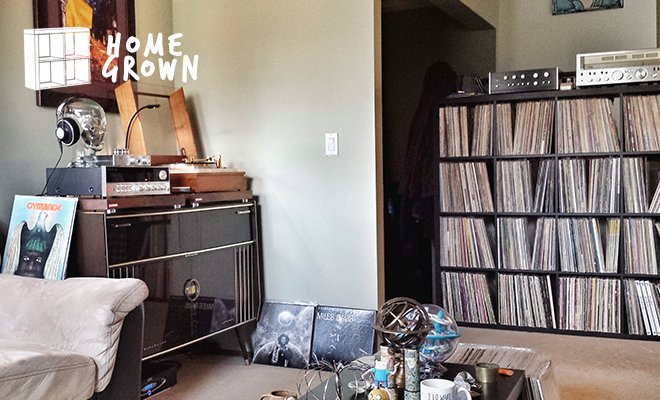
What are the coordinates of `floor` in the screenshot? It's located at (631, 379).